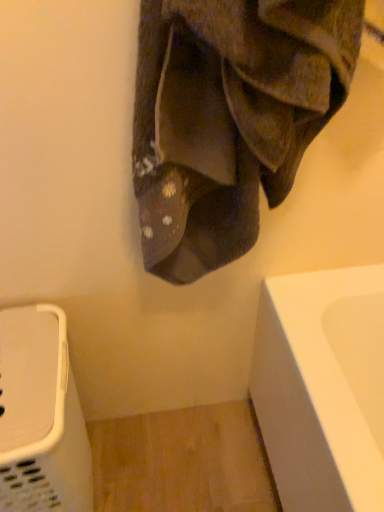
Question: From the image's perspective, is brown suede shoes at upper center positioned above or below white plastic laundry basket at lower left?

Choices:
 (A) below
 (B) above

Answer: (B)

Question: Based on their sizes in the image, would you say brown suede shoes at upper center is bigger or smaller than white plastic laundry basket at lower left?

Choices:
 (A) big
 (B) small

Answer: (B)

Question: Is brown suede shoes at upper center spatially inside white plastic laundry basket at lower left, or outside of it?

Choices:
 (A) outside
 (B) inside

Answer: (A)

Question: Is white plastic laundry basket at lower left situated inside brown suede shoes at upper center or outside?

Choices:
 (A) inside
 (B) outside

Answer: (B)

Question: Considering their positions, is white plastic laundry basket at lower left located in front of or behind brown suede shoes at upper center?

Choices:
 (A) behind
 (B) front

Answer: (A)

Question: From the image's perspective, is white plastic laundry basket at lower left above or below brown suede shoes at upper center?

Choices:
 (A) above
 (B) below

Answer: (B)

Question: Is white plastic laundry basket at lower left to the left or to the right of brown suede shoes at upper center in the image?

Choices:
 (A) right
 (B) left

Answer: (B)